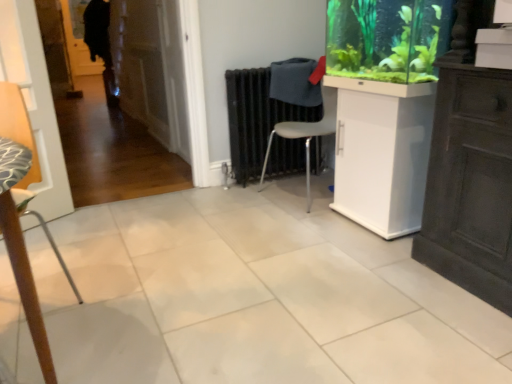
Question: Is white glossy cabinet at center right not near gray plastic chair at center, which is counted as the 1th chair, starting from the right?

Choices:
 (A) yes
 (B) no

Answer: (B)

Question: From a real-world perspective, is white glossy cabinet at center right on gray plastic chair at center, marked as the first chair in a back-to-front arrangement?

Choices:
 (A) no
 (B) yes

Answer: (A)

Question: Is gray plastic chair at center, marked as the first chair in a back-to-front arrangement, completely or partially inside white glossy cabinet at center right?

Choices:
 (A) no
 (B) yes

Answer: (A)

Question: Is white glossy cabinet at center right positioned in front of gray plastic chair at center, arranged as the second chair when viewed from the left?

Choices:
 (A) yes
 (B) no

Answer: (A)

Question: Does white glossy cabinet at center right have a lesser width compared to gray plastic chair at center, which is counted as the 1th chair, starting from the right?

Choices:
 (A) no
 (B) yes

Answer: (B)

Question: From a real-world perspective, is green glossy aquarium at upper right above or below gray plastic chair at center, arranged as the second chair when viewed from the left?

Choices:
 (A) above
 (B) below

Answer: (A)

Question: In the image, is green glossy aquarium at upper right on the left side or the right side of gray plastic chair at center, marked as the first chair in a back-to-front arrangement?

Choices:
 (A) left
 (B) right

Answer: (B)

Question: Relative to gray plastic chair at center, marked as the first chair in a back-to-front arrangement, is green glossy aquarium at upper right in front or behind?

Choices:
 (A) front
 (B) behind

Answer: (A)

Question: Looking at the image, does green glossy aquarium at upper right seem bigger or smaller compared to gray plastic chair at center, arranged as the second chair when viewed from the left?

Choices:
 (A) big
 (B) small

Answer: (B)

Question: Considering the relative positions of gray plastic chair at center, which ranks as the second chair in front-to-back order, and green glossy aquarium at upper right in the image provided, is gray plastic chair at center, which ranks as the second chair in front-to-back order, to the left or to the right of green glossy aquarium at upper right?

Choices:
 (A) left
 (B) right

Answer: (A)

Question: Considering the positions of gray plastic chair at center, arranged as the second chair when viewed from the left, and green glossy aquarium at upper right in the image, is gray plastic chair at center, arranged as the second chair when viewed from the left, wider or thinner than green glossy aquarium at upper right?

Choices:
 (A) thin
 (B) wide

Answer: (B)

Question: From a real-world perspective, is gray plastic chair at center, which is counted as the 1th chair, starting from the right, physically located above or below green glossy aquarium at upper right?

Choices:
 (A) above
 (B) below

Answer: (B)

Question: Do you think gray plastic chair at center, marked as the first chair in a back-to-front arrangement, is within green glossy aquarium at upper right, or outside of it?

Choices:
 (A) outside
 (B) inside

Answer: (A)

Question: Looking at their shapes, would you say wooden textured chair at left, which ranks as the 1th chair in left-to-right order, is wider or thinner than white glossy cabinet at center right?

Choices:
 (A) wide
 (B) thin

Answer: (B)

Question: Is wooden textured chair at left, which is counted as the first chair, starting from the front, taller or shorter than white glossy cabinet at center right?

Choices:
 (A) short
 (B) tall

Answer: (B)